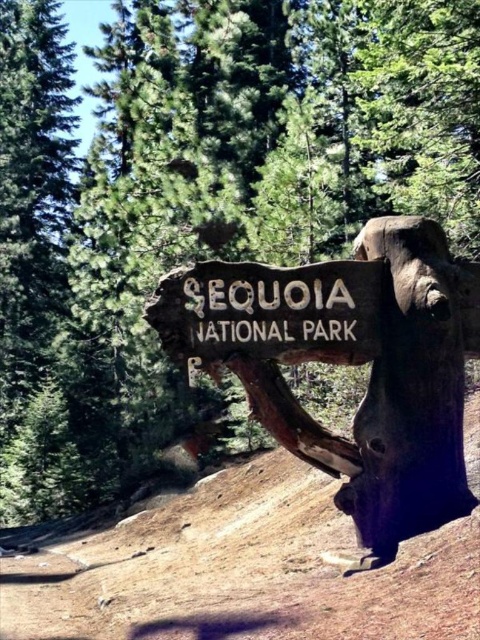
Does brown dirt track at lower left appear on the right side of weathered wood sign at center?

No, brown dirt track at lower left is not to the right of weathered wood sign at center.

Locate an element on the screen. This screenshot has width=480, height=640. brown dirt track at lower left is located at coordinates (241, 570).

The width and height of the screenshot is (480, 640). Describe the element at coordinates (241, 570) in the screenshot. I see `brown dirt track at lower left` at that location.

At what (x,y) coordinates should I click in order to perform the action: click on brown dirt track at lower left. Please return your answer as a coordinate pair (x, y). Looking at the image, I should click on (241, 570).